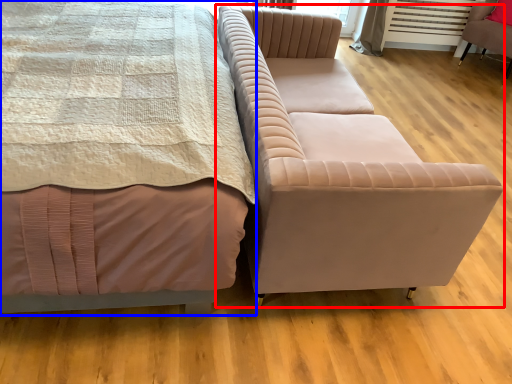
Question: Which point is closer to the camera, studio couch (highlighted by a red box) or bed (highlighted by a blue box)?

Choices:
 (A) studio couch
 (B) bed

Answer: (B)